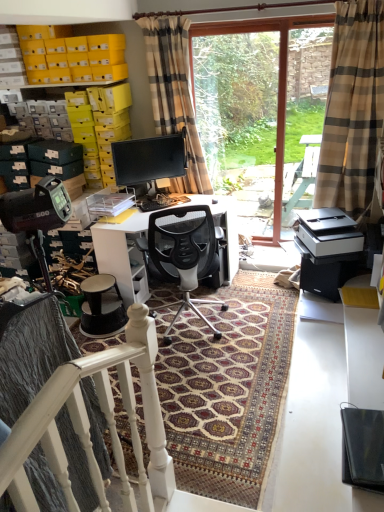
This screenshot has height=512, width=384. Find the location of `free space on the front side of black mesh office chair at center`. free space on the front side of black mesh office chair at center is located at coordinates (185, 368).